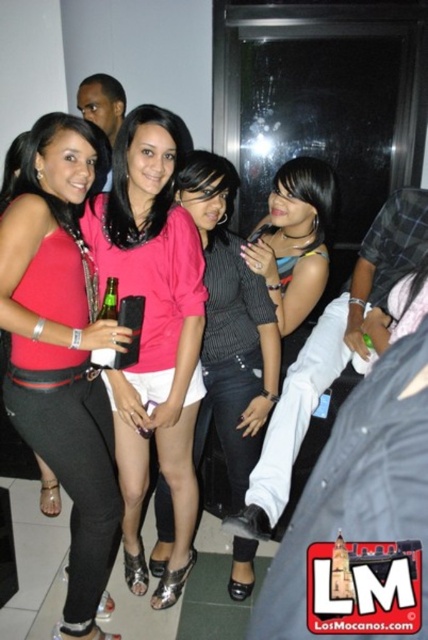
Question: Does pink matte shirt at center appear under multicolored striped shirt at center?

Choices:
 (A) no
 (B) yes

Answer: (B)

Question: Which point is farther from the camera taking this photo?

Choices:
 (A) (326, 170)
 (B) (71, 264)

Answer: (A)

Question: Does pink satin blouse at center appear on the left side of pink matte shirt at center?

Choices:
 (A) yes
 (B) no

Answer: (A)

Question: Estimate the real-world distances between objects in this image. Which object is farther from the matte pink blouse at center?

Choices:
 (A) pink satin blouse at center
 (B) multicolored striped shirt at center
 (C) pink matte shirt at center

Answer: (B)

Question: Based on their relative distances, which object is nearer to the pink matte shirt at center?

Choices:
 (A) matte pink blouse at center
 (B) pink satin blouse at center
 (C) multicolored striped shirt at center

Answer: (B)

Question: From the image, what is the correct spatial relationship of pink satin blouse at center in relation to multicolored striped shirt at center?

Choices:
 (A) below
 (B) above

Answer: (A)